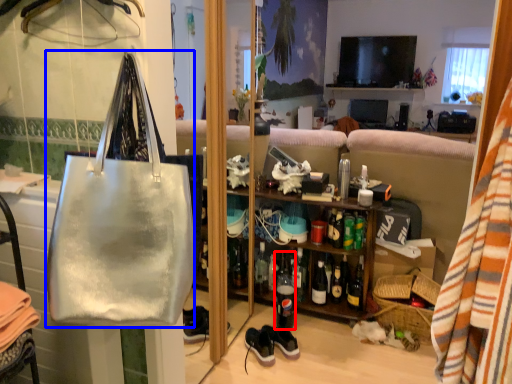
Question: Which object is further to the camera taking this photo, bottle (highlighted by a red box) or handbag (highlighted by a blue box)?

Choices:
 (A) bottle
 (B) handbag

Answer: (A)